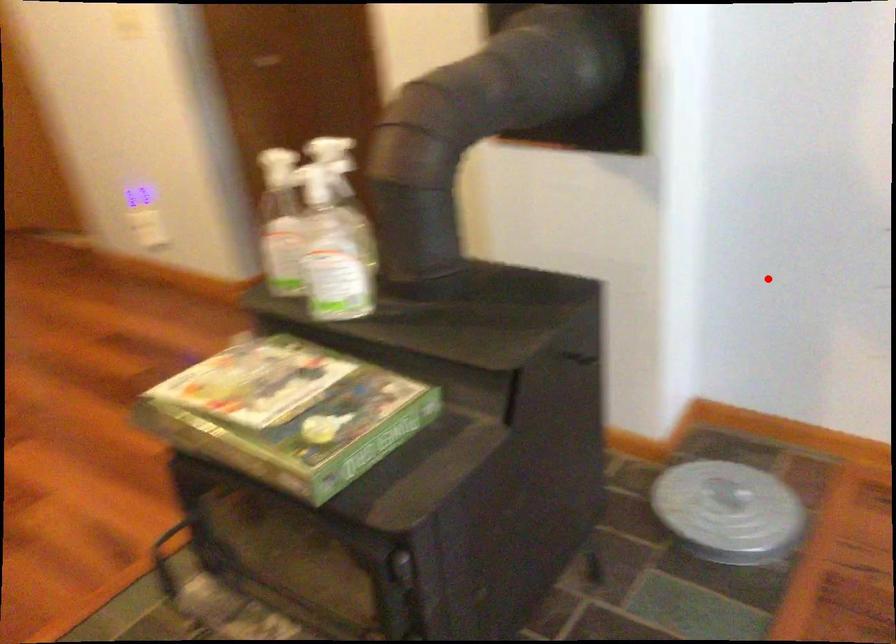
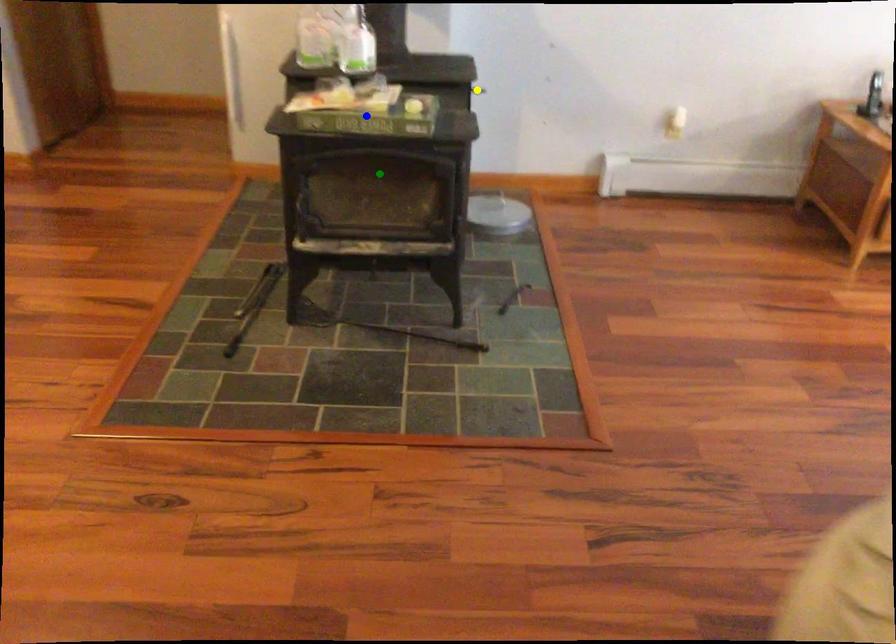
Question: I am providing you with two images of the same scene from different viewpoints. A red point is marked on the first image. You are given multiple points on the second image. Which spot in image 2 lines up with the point in image 1?

Choices:
 (A) green point
 (B) blue point
 (C) yellow point

Answer: (C)